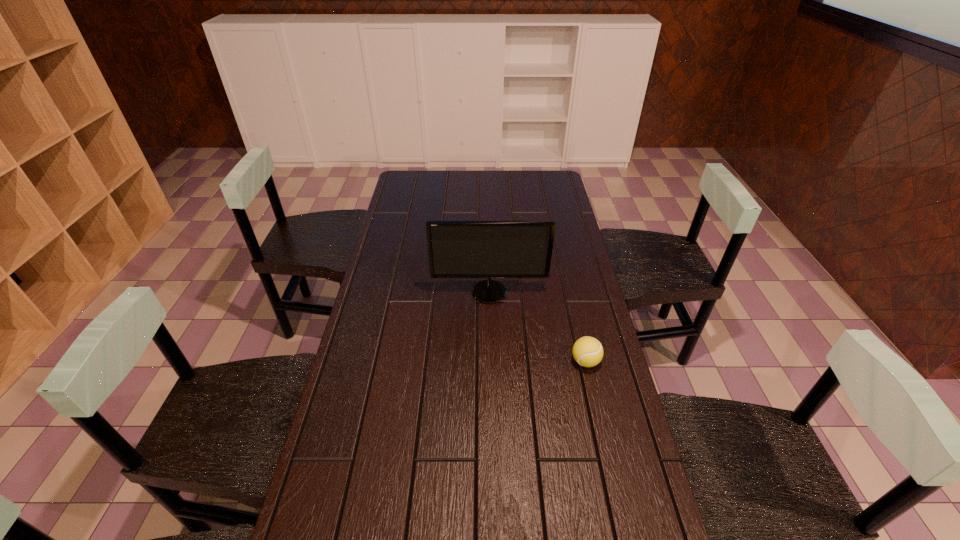
In the image, there is a desktop. Where is `vacant space at the right edge`? The image size is (960, 540). vacant space at the right edge is located at coordinates (615, 478).

Locate an element on the screen. The image size is (960, 540). free spot at the far left corner of the desktop is located at coordinates (423, 174).

Find the location of a particular element. This screenshot has height=540, width=960. vacant region at the far right corner of the desktop is located at coordinates (533, 194).

I want to click on free spot that satisfies the following two spatial constraints: 1. on the front-facing side of the tennis ball; 2. on the left side of the farther object, so click(x=491, y=361).

The width and height of the screenshot is (960, 540). Find the location of `free point that satisfies the following two spatial constraints: 1. on the front-facing side of the left object; 2. on the left side of the nearer object`. free point that satisfies the following two spatial constraints: 1. on the front-facing side of the left object; 2. on the left side of the nearer object is located at coordinates (491, 361).

The width and height of the screenshot is (960, 540). Identify the location of free space that satisfies the following two spatial constraints: 1. on the front-facing side of the nearer object; 2. on the right side of the computer monitor. (491, 361).

Locate an element on the screen. This screenshot has height=540, width=960. free space that satisfies the following two spatial constraints: 1. on the front-facing side of the computer monitor; 2. on the left side of the right object is located at coordinates (491, 361).

Find the location of `vacant area that satisfies the following two spatial constraints: 1. on the front-facing side of the tennis ball; 2. on the left side of the computer monitor`. vacant area that satisfies the following two spatial constraints: 1. on the front-facing side of the tennis ball; 2. on the left side of the computer monitor is located at coordinates (491, 361).

Locate an element on the screen. free space in the image that satisfies the following two spatial constraints: 1. on the front-facing side of the tennis ball; 2. on the right side of the taller object is located at coordinates (491, 361).

The image size is (960, 540). I want to click on vacant space that satisfies the following two spatial constraints: 1. on the front-facing side of the right object; 2. on the right side of the computer monitor, so click(x=491, y=361).